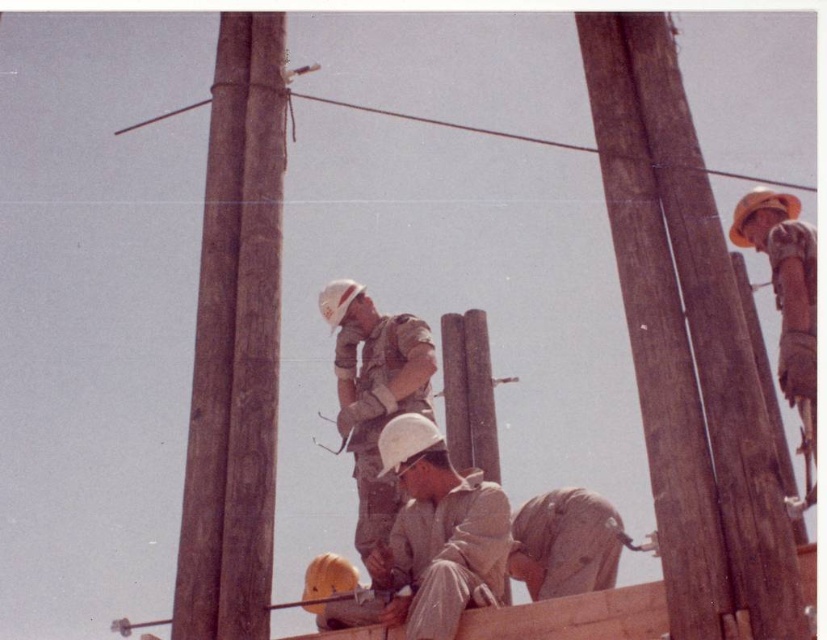
Consider the image. Does brown wooden telegraph pole at right have a greater height compared to matte white helmet at center?

No, brown wooden telegraph pole at right is not taller than matte white helmet at center.

Does brown wooden telegraph pole at right have a lesser height compared to matte white helmet at center?

Yes.

Which is in front, point (639, 372) or point (438, 579)?

Point (639, 372) is more forward.

Locate an element on the screen. This screenshot has width=827, height=640. brown wooden telegraph pole at right is located at coordinates (656, 340).

Can you confirm if brown wood telegraph pole at left is positioned to the left of camouflage fabric soldier at center?

Correct, you'll find brown wood telegraph pole at left to the left of camouflage fabric soldier at center.

Does brown wood telegraph pole at left have a lesser height compared to camouflage fabric soldier at center?

Indeed, brown wood telegraph pole at left has a lesser height compared to camouflage fabric soldier at center.

At what (x,y) coordinates should I click in order to perform the action: click on brown wood telegraph pole at left. Please return your answer as a coordinate pair (x, y). Image resolution: width=827 pixels, height=640 pixels. Looking at the image, I should click on (235, 342).

The width and height of the screenshot is (827, 640). What are the coordinates of `brown wood telegraph pole at left` in the screenshot? It's located at [235, 342].

Is brown wood telegraph pole at left in front of matte white helmet at center?

No, brown wood telegraph pole at left is behind matte white helmet at center.

Find the location of `brown wood telegraph pole at left`. brown wood telegraph pole at left is located at coordinates (235, 342).